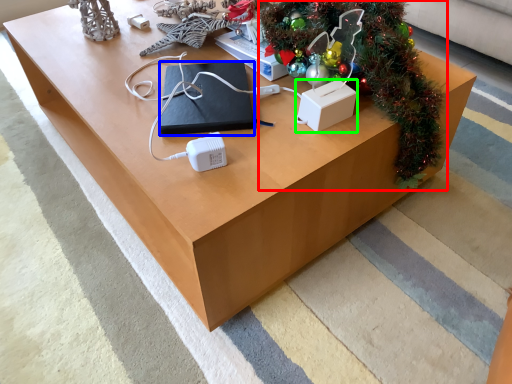
Question: Based on their relative distances, which object is farther from christmas tree (highlighted by a red box)? Choose from pad (highlighted by a blue box) and box (highlighted by a green box).

Choices:
 (A) pad
 (B) box

Answer: (A)